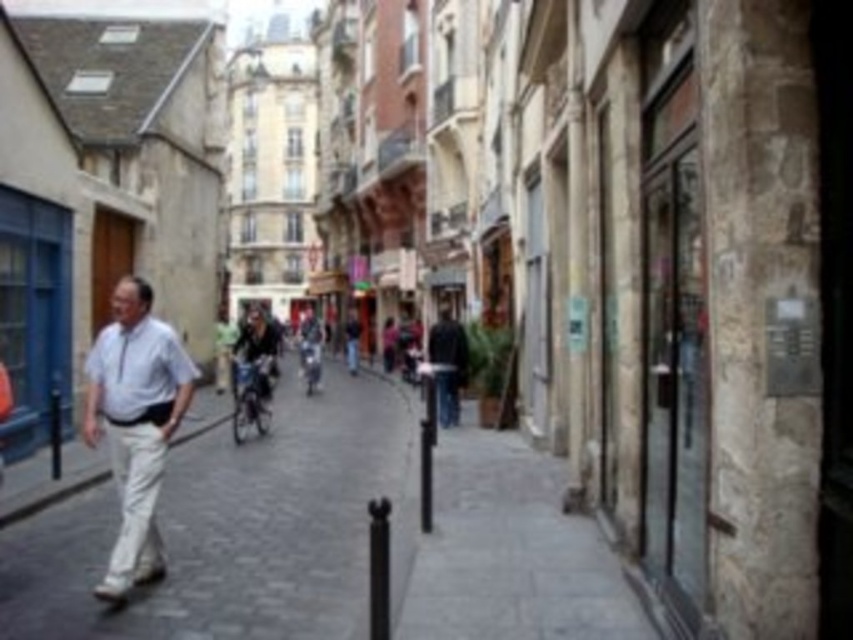
You are a photographer standing at the end of the narrow cobblestone street. You want to capture a photo of the gray cobblestone pavement at center and the white cotton shirt at center. Which object is wider in the scene?

The gray cobblestone pavement at center is wider than the white cotton shirt at center.

You are a delivery person carrying a package that requires a 110 meter delivery radius. You are currently standing at the white cotton shirt at center and need to deliver to the matte gray jacket at center. Can you complete the delivery within the radius?

The distance between the white cotton shirt at center and the matte gray jacket at center is 109.27 meters, which is within the 110 meter delivery radius. Yes, you can complete the delivery.